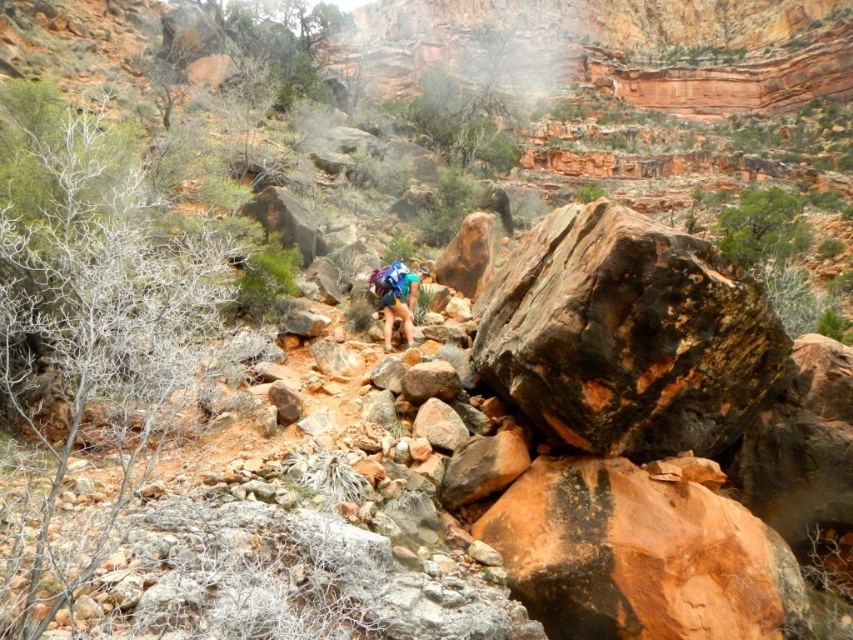
You are a hiker trying to place your backpack on a flat surface. The rusty brown rock at right has coordinates at point 0.525, 0.736. Can you confirm if this rock is positioned to the right side of the image?

The rusty brown rock at right is located at point (627, 336), so yes, it is positioned to the right side of the image as its x coordinate is 0.525 which is more than 0.5.

You are a hiker trying to place your blue fabric backpack at center on a stable surface. Based on the scene, can you place it on the rusty brown rock at right?

The rusty brown rock at right is below the blue fabric backpack at center, so the backpack is already positioned above the rock. To place it on the rock, you would need to move it downward from its current position.